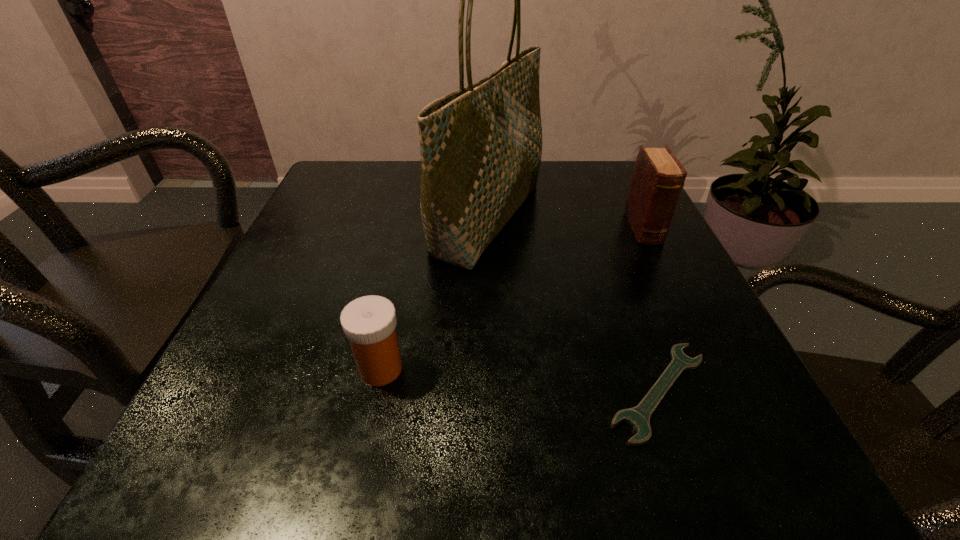
The image size is (960, 540). In order to click on free location at the far left corner of the desktop in this screenshot , I will do `click(362, 173)`.

In the image, there is a desktop. Where is `vacant space at the near left corner`? The height and width of the screenshot is (540, 960). vacant space at the near left corner is located at coordinates (244, 484).

Where is `unoccupied area between the shopping bag and the wrench`? Image resolution: width=960 pixels, height=540 pixels. unoccupied area between the shopping bag and the wrench is located at coordinates (574, 305).

At what (x,y) coordinates should I click in order to perform the action: click on vacant area between the wrench and the diary. Please return your answer as a coordinate pair (x, y). Looking at the image, I should click on (652, 310).

You are a GUI agent. You are given a task and a screenshot of the screen. Output one action in this format:
    pyautogui.click(x=<x>, y=<y>)
    Task: Click on the vacant area that lies between the shortest object and the diary
    This screenshot has width=960, height=540.
    Given the screenshot: What is the action you would take?
    pyautogui.click(x=652, y=310)

Where is `blank region between the third shortest object and the tallest object`? blank region between the third shortest object and the tallest object is located at coordinates (566, 223).

At what (x,y) coordinates should I click in order to perform the action: click on free space between the third object from right to left and the medicine. Please return your answer as a coordinate pair (x, y). The height and width of the screenshot is (540, 960). Looking at the image, I should click on (434, 293).

Image resolution: width=960 pixels, height=540 pixels. In order to click on empty location between the shortest object and the diary in this screenshot , I will do `click(652, 310)`.

I want to click on empty space that is in between the diary and the wrench, so tap(652, 310).

This screenshot has width=960, height=540. In order to click on free spot between the shortest object and the leftmost object in this screenshot , I will do `click(519, 380)`.